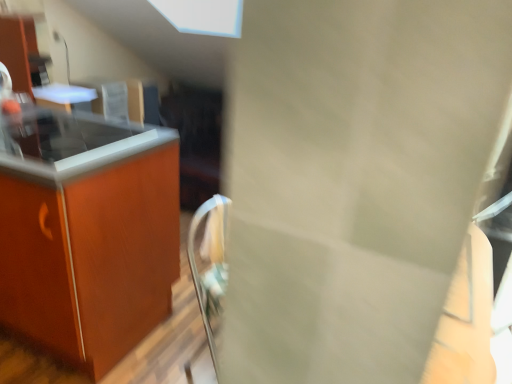
Question: In terms of size, does smooth glass countertop at left, acting as the second countertop starting from the bottom, appear bigger or smaller than matte wood countertop at left, acting as the first countertop starting from the bottom?

Choices:
 (A) small
 (B) big

Answer: (A)

Question: In terms of height, does smooth glass countertop at left, acting as the second countertop starting from the bottom, look taller or shorter compared to matte wood countertop at left, acting as the first countertop starting from the bottom?

Choices:
 (A) short
 (B) tall

Answer: (A)

Question: In the image, is smooth glass countertop at left, which appears as the 1th countertop when viewed from the top, positioned in front of or behind matte wood countertop at left, the second countertop in the top-to-bottom sequence?

Choices:
 (A) behind
 (B) front

Answer: (A)

Question: Does point pyautogui.click(x=98, y=231) appear closer or farther from the camera than point pyautogui.click(x=170, y=135)?

Choices:
 (A) farther
 (B) closer

Answer: (B)

Question: Is matte wood countertop at left, the second countertop in the top-to-bottom sequence, taller or shorter than smooth glass countertop at left, acting as the second countertop starting from the bottom?

Choices:
 (A) tall
 (B) short

Answer: (A)

Question: From the image's perspective, is matte wood countertop at left, the second countertop in the top-to-bottom sequence, above or below smooth glass countertop at left, acting as the second countertop starting from the bottom?

Choices:
 (A) below
 (B) above

Answer: (A)

Question: Considering their positions, is matte wood countertop at left, the second countertop in the top-to-bottom sequence, located in front of or behind smooth glass countertop at left, acting as the second countertop starting from the bottom?

Choices:
 (A) front
 (B) behind

Answer: (A)